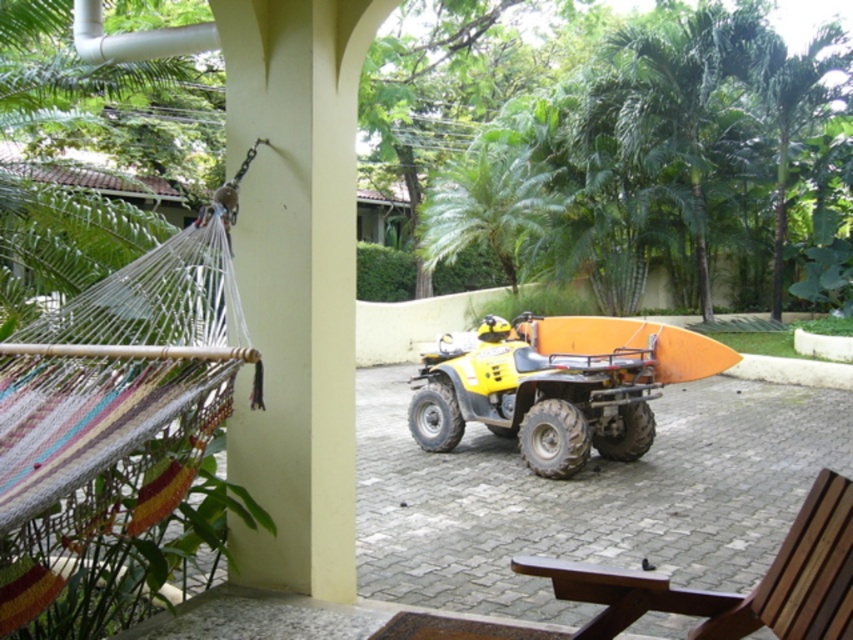
You are planning to move the brown wooden chair at lower right closer to the orange matte surfboard at center. Based on their current positions, which direction should you move the chair to get it closer to the surfboard?

The brown wooden chair at lower right is to the left of orange matte surfboard at center. To move it closer, you should move the chair to the right towards the surfboard.

Consider the image. You are planning to set up a small table between the brown wooden chair at lower right and the orange matte surfboard at center. Based on their positions, can you place the table there without moving either object?

The brown wooden chair at lower right is located below the orange matte surfboard at center, so placing a table between them would require vertical space. Since the chair is below the surfboard, the table can be placed between them horizontally as they are not overlapping in the vertical plane.

You are planning to set up a small outdoor lounge area and have both the brown wooden chair at lower right and the orange matte surfboard at center. Which object would you choose if you need something to sit on?

The brown wooden chair at lower right is smaller than the orange matte surfboard at center, so it is more suitable for sitting.